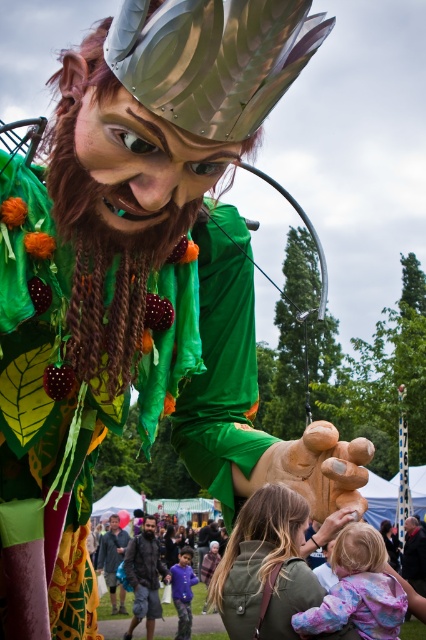
Question: Does green fabric jacket at lower center have a lesser width compared to matte brown wooden head at center?

Choices:
 (A) no
 (B) yes

Answer: (A)

Question: Among these objects, which one is nearest to the camera?

Choices:
 (A) matte brown head at lower center
 (B) dark brown leather jacket at lower center

Answer: (B)

Question: Which object is closer to the camera taking this photo?

Choices:
 (A) dark brown leather jacket at lower center
 (B) blonde hair at lower center

Answer: (B)

Question: Which object appears farthest from the camera in this image?

Choices:
 (A) matte black helmet at upper center
 (B) purple matte shirt at lower center

Answer: (A)

Question: Does pastel tie-dye fabric at lower center have a smaller size compared to brown matte head at center?

Choices:
 (A) no
 (B) yes

Answer: (A)

Question: Can you confirm if purple matte shirt at lower center is positioned to the right of brown matte head at center?

Choices:
 (A) yes
 (B) no

Answer: (B)